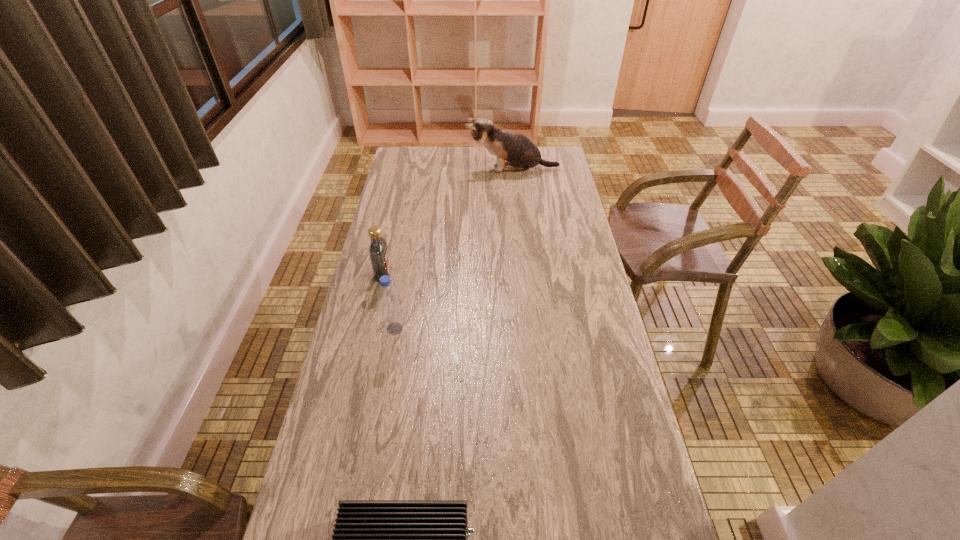
Where is `vacant area between the leftmost object and the farthest object`? vacant area between the leftmost object and the farthest object is located at coordinates 447,221.

This screenshot has width=960, height=540. I want to click on object identified as the second closest to the third nearest object, so click(520, 153).

This screenshot has height=540, width=960. I want to click on the closest object relative to the bottle, so click(378, 250).

This screenshot has height=540, width=960. I want to click on vacant space that satisfies the following two spatial constraints: 1. on the front-facing side of the leftmost object; 2. on the right side of the bottle, so click(371, 329).

Locate an element on the screen. This screenshot has width=960, height=540. free location that satisfies the following two spatial constraints: 1. at the face of the farthest object; 2. on the front side of the bottle is located at coordinates (528, 329).